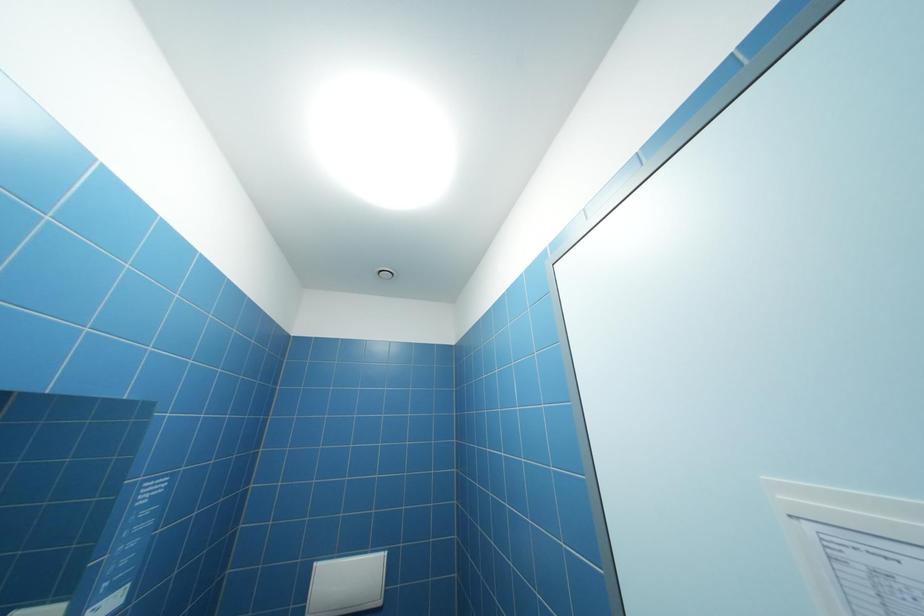
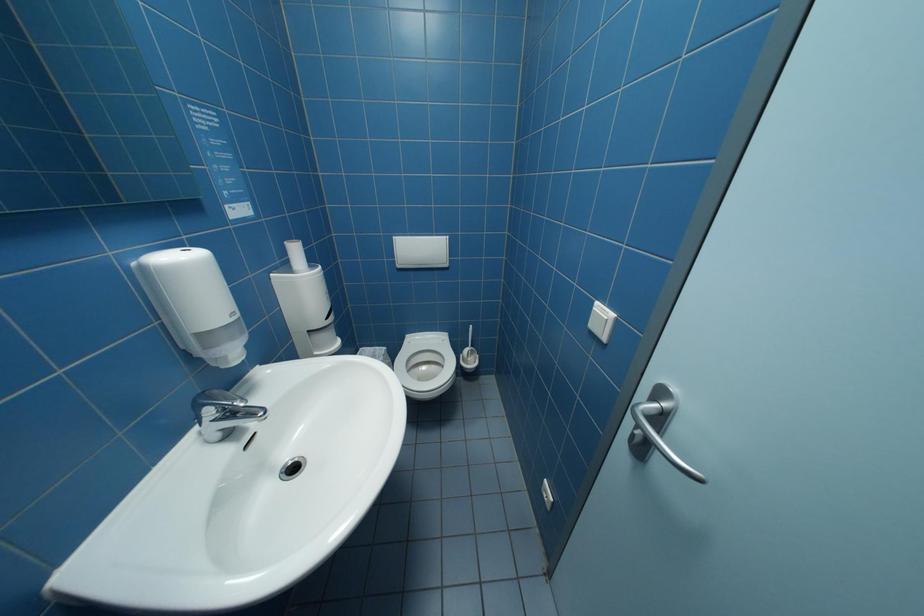
Question: Based on the continuous images, in which direction is the camera rotating? Reply with the corresponding letter.

Choices:
 (A) Left
 (B) Right
 (C) Up
 (D) Down

Answer: (D)